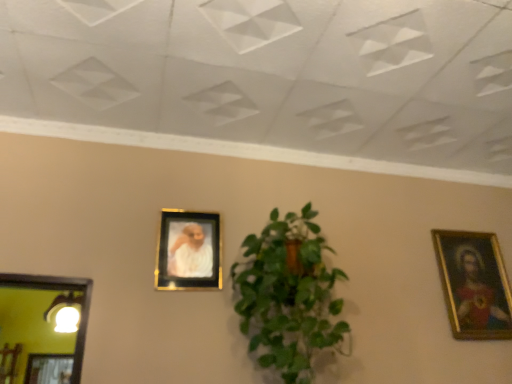
Question: Is point (249, 294) positioned closer to the camera than point (477, 324)?

Choices:
 (A) farther
 (B) closer

Answer: (B)

Question: From a real-world perspective, is green leafy plant at center physically located above or below gold-framed painting at right, which is counted as the second picture frame, starting from the front?

Choices:
 (A) above
 (B) below

Answer: (B)

Question: Based on their relative distances, which object is nearer to the gold metallic picture frame at center, which is counted as the second picture frame, starting from the back?

Choices:
 (A) gold-framed painting at right, the 1th picture frame from the right
 (B) green leafy plant at center

Answer: (B)

Question: Based on their relative distances, which object is nearer to the gold metallic picture frame at center, the 2th picture frame when ordered from right to left?

Choices:
 (A) gold-framed painting at right, which is counted as the second picture frame, starting from the front
 (B) green leafy plant at center

Answer: (B)